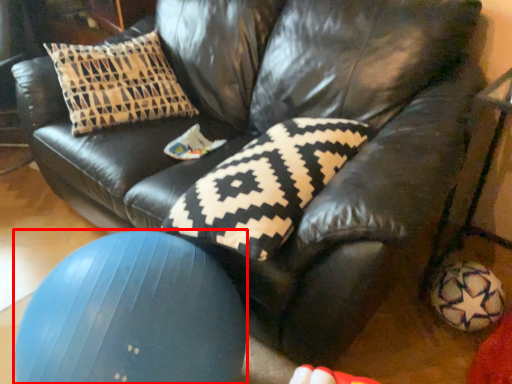
Question: From the image, what is the correct spatial relationship of ball (annotated by the red box) in relation to pillow?

Choices:
 (A) left
 (B) right

Answer: (A)